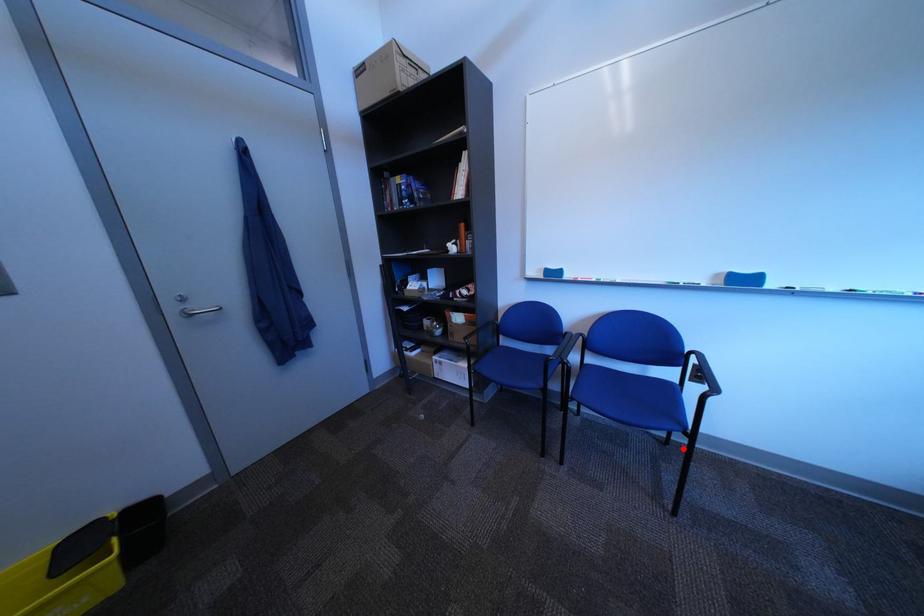
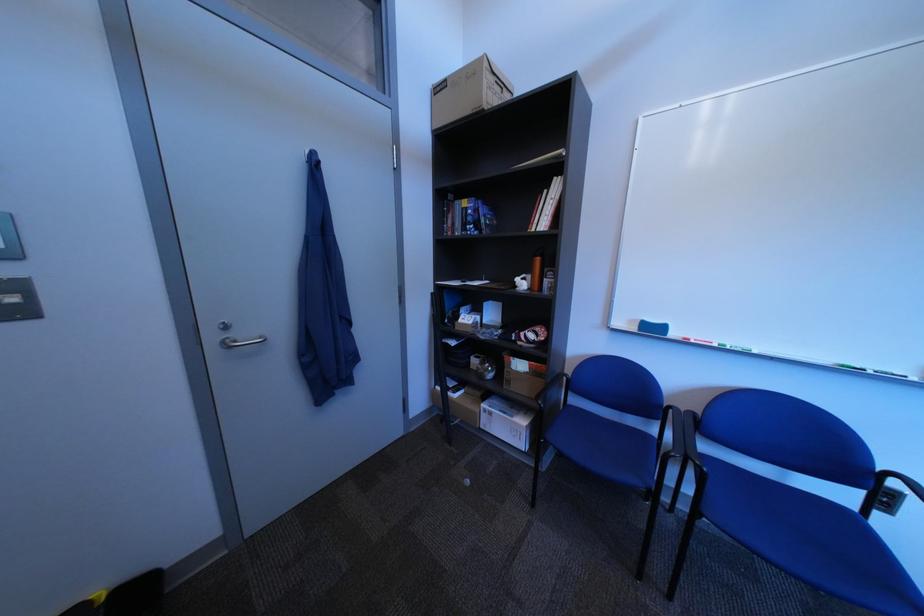
Locate, in the second image, the point that corresponds to the highlighted location in the first image.

(840, 596)